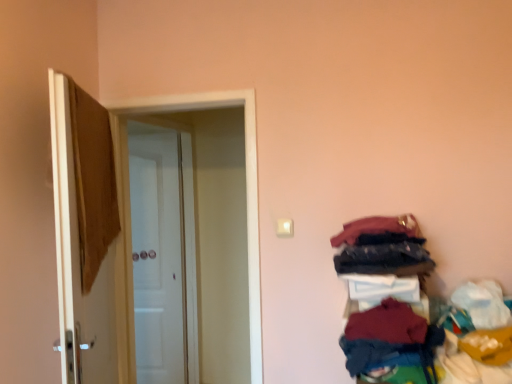
Question: Is dark red fabric at lower right, marked as the 3th clothing in a top-to-bottom arrangement, not close to dark blue fabric at right, the 3th clothing when ordered from bottom to top?

Choices:
 (A) no
 (B) yes

Answer: (A)

Question: Considering the relative sizes of dark red fabric at lower right, acting as the second clothing starting from the bottom, and dark blue fabric at right, the 3th clothing when ordered from bottom to top, in the image provided, is dark red fabric at lower right, acting as the second clothing starting from the bottom, thinner than dark blue fabric at right, the 3th clothing when ordered from bottom to top,?

Choices:
 (A) yes
 (B) no

Answer: (A)

Question: Is dark red fabric at lower right, acting as the second clothing starting from the bottom, to the right of dark blue fabric at right, the second clothing when ordered from top to bottom, from the viewer's perspective?

Choices:
 (A) no
 (B) yes

Answer: (A)

Question: Is dark blue fabric at right, the 3th clothing when ordered from bottom to top, inside dark red fabric at lower right, acting as the second clothing starting from the bottom?

Choices:
 (A) no
 (B) yes

Answer: (A)

Question: Is dark blue fabric at right, the second clothing when ordered from top to bottom, at the back of dark red fabric at lower right, marked as the 3th clothing in a top-to-bottom arrangement?

Choices:
 (A) no
 (B) yes

Answer: (A)

Question: In the image, is dark red fabric at lower right, marked as the 3th clothing in a top-to-bottom arrangement, positioned in front of or behind white glossy door at center, which is counted as the second door, starting from the back?

Choices:
 (A) front
 (B) behind

Answer: (A)

Question: Is dark red fabric at lower right, acting as the second clothing starting from the bottom, taller or shorter than white glossy door at center, the 2th door positioned from the front?

Choices:
 (A) short
 (B) tall

Answer: (A)

Question: Is dark red fabric at lower right, acting as the second clothing starting from the bottom, inside the boundaries of white glossy door at center, the 2th door positioned from the front, or outside?

Choices:
 (A) inside
 (B) outside

Answer: (B)

Question: In terms of size, does dark red fabric at lower right, marked as the 3th clothing in a top-to-bottom arrangement, appear bigger or smaller than white glossy door at center, which is counted as the second door, starting from the back?

Choices:
 (A) big
 (B) small

Answer: (B)

Question: In the image, is white glossy door at center, the 2th door positioned from the front, positioned in front of or behind velvet-like red fabric at upper right, which is the 4th clothing in bottom-to-top order?

Choices:
 (A) behind
 (B) front

Answer: (A)

Question: Is white glossy door at center, which is counted as the second door, starting from the back, to the left or to the right of velvet-like red fabric at upper right, which is the 4th clothing in bottom-to-top order, in the image?

Choices:
 (A) left
 (B) right

Answer: (A)

Question: From the image's perspective, is white glossy door at center, the 2th door positioned from the front, positioned above or below velvet-like red fabric at upper right, which is the 4th clothing in bottom-to-top order?

Choices:
 (A) below
 (B) above

Answer: (A)

Question: Considering the positions of point (57, 269) and point (409, 233), is point (57, 269) closer or farther from the camera than point (409, 233)?

Choices:
 (A) farther
 (B) closer

Answer: (B)

Question: Considering the positions of white glossy door at center, which is counted as the second door, starting from the back, and brown fabric at left, the first door positioned from the front, in the image, is white glossy door at center, which is counted as the second door, starting from the back, wider or thinner than brown fabric at left, the first door positioned from the front,?

Choices:
 (A) thin
 (B) wide

Answer: (B)

Question: Do you think white glossy door at center, the 2th door positioned from the front, is within brown fabric at left, the third door from the back, or outside of it?

Choices:
 (A) outside
 (B) inside

Answer: (A)